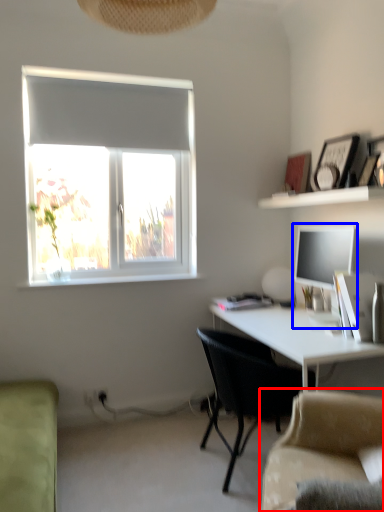
Question: Which object appears closest to the camera in this image, studio couch (highlighted by a red box) or desktop computer (highlighted by a blue box)?

Choices:
 (A) studio couch
 (B) desktop computer

Answer: (A)